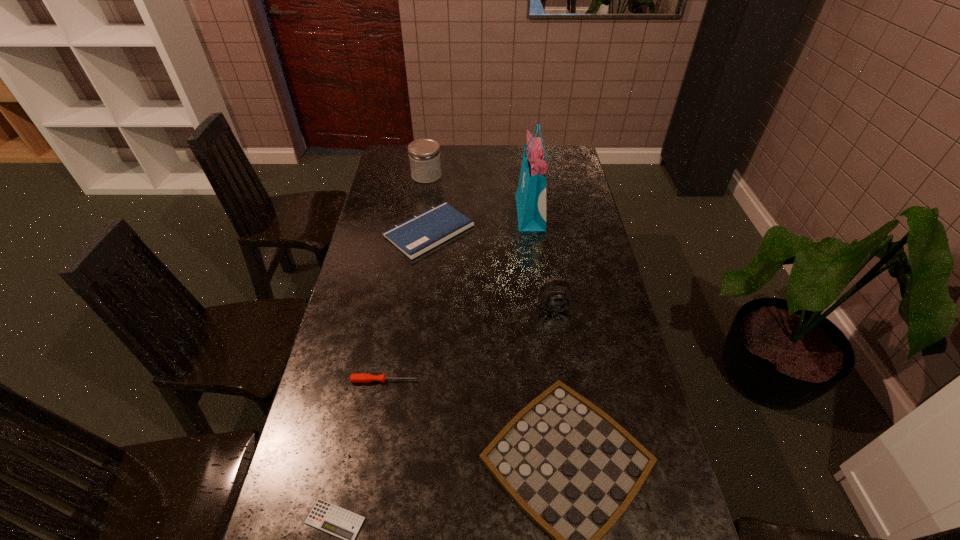
Locate an element on the screen. This screenshot has height=540, width=960. vacant area at the right edge of the desktop is located at coordinates (588, 280).

The height and width of the screenshot is (540, 960). I want to click on vacant space at the far right corner, so click(x=569, y=152).

At what (x,y) coordinates should I click in order to perform the action: click on vacant area between the fifth farthest object and the fourth tallest object. Please return your answer as a coordinate pair (x, y). This screenshot has height=540, width=960. Looking at the image, I should click on (407, 306).

Where is `free point between the telephoto lens and the paperback book`? Image resolution: width=960 pixels, height=540 pixels. free point between the telephoto lens and the paperback book is located at coordinates (492, 268).

In order to click on vacant space that's between the shopping bag and the farthest object in this screenshot , I will do `click(478, 194)`.

Choose which object is the sixth nearest neighbor to the checkerboard. Please provide its 2D coordinates. Your answer should be formatted as a tuple, i.e. [(x, y)], where the tuple contains the x and y coordinates of a point satisfying the conditions above.

[(424, 154)]

You are a GUI agent. You are given a task and a screenshot of the screen. Output one action in this format:
    pyautogui.click(x=<x>, y=<y>)
    Task: Click on the object that is the sixth closest to the third nearest object
    This screenshot has width=960, height=540.
    Given the screenshot: What is the action you would take?
    pyautogui.click(x=424, y=154)

You are a GUI agent. You are given a task and a screenshot of the screen. Output one action in this format:
    pyautogui.click(x=<x>, y=<y>)
    Task: Click on the free location that satisfies the following two spatial constraints: 1. on the front-facing side of the fifth shortest object; 2. at the tip of the fifth farthest object
    
    Given the screenshot: What is the action you would take?
    pyautogui.click(x=566, y=381)

The image size is (960, 540). What are the coordinates of `free space that satisfies the following two spatial constraints: 1. on the front side of the paperback book; 2. on the left side of the farthest object` in the screenshot? It's located at (418, 231).